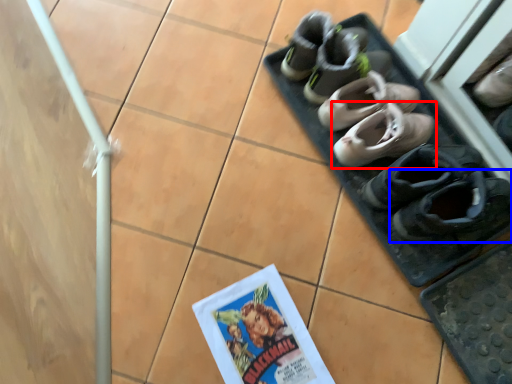
Question: Which point is closer to the camera, footwear (highlighted by a red box) or footwear (highlighted by a blue box)?

Choices:
 (A) footwear
 (B) footwear

Answer: (B)